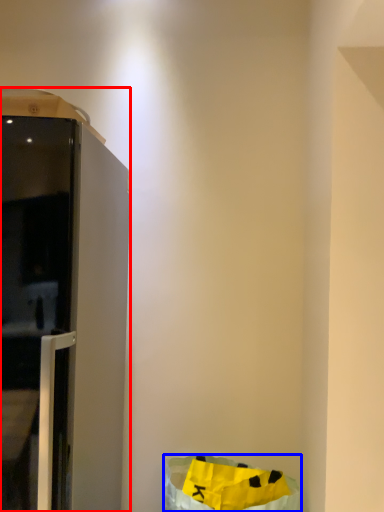
Question: Which object appears closest to the camera in this image, furniture (highlighted by a red box) or recycling bin (highlighted by a blue box)?

Choices:
 (A) furniture
 (B) recycling bin

Answer: (A)